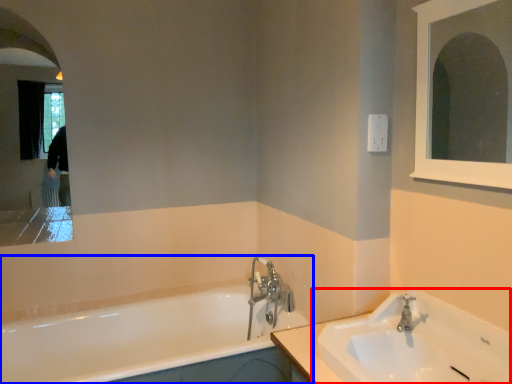
Question: Which object appears farthest to the camera in this image, sink (highlighted by a red box) or bathtub (highlighted by a blue box)?

Choices:
 (A) sink
 (B) bathtub

Answer: (B)